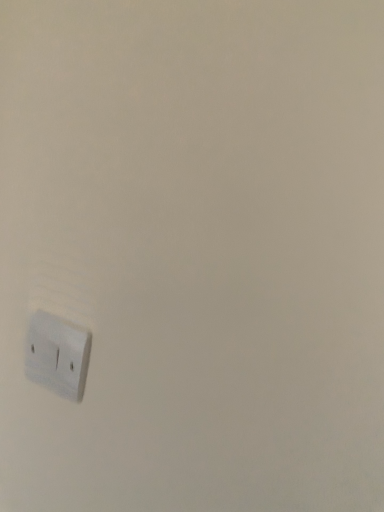
Identify the location of white plastic socket at lower left. (57, 354).

What do you see at coordinates (57, 354) in the screenshot?
I see `white plastic socket at lower left` at bounding box center [57, 354].

Locate an element on the screen. white plastic socket at lower left is located at coordinates (57, 354).